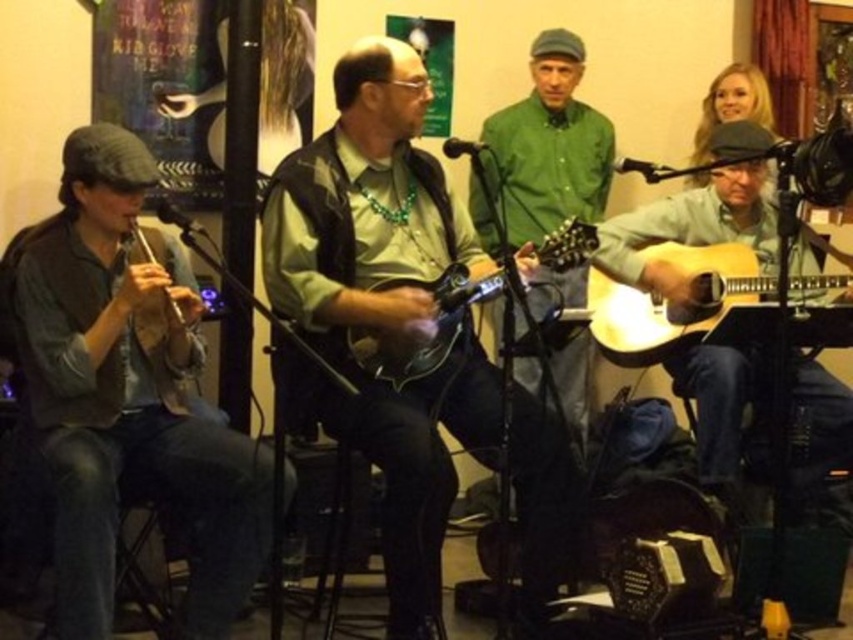
Locate an element on the screen. The width and height of the screenshot is (853, 640). brushed silver flute at left is located at coordinates (126, 396).

How distant is brushed silver flute at left from light brown wood guitar at right?

brushed silver flute at left is 6.16 feet away from light brown wood guitar at right.

Find the location of `brushed silver flute at left`. brushed silver flute at left is located at coordinates (126, 396).

I want to click on brushed silver flute at left, so click(x=126, y=396).

Does green matte mandolin at center appear under light brown wood guitar at right?

Yes.

Does point (564, 508) come farther from viewer compared to point (755, 237)?

No.

Is point (438, 212) less distant than point (848, 460)?

Yes, point (438, 212) is in front of point (848, 460).

Find the location of `green matte mandolin at center`. green matte mandolin at center is located at coordinates (381, 307).

Looking at this image, is brushed silver flute at left positioned in front of light wood acoustic guitar at right?

Yes, it is.

Who is more distant from viewer, (86, 564) or (659, 317)?

The point (659, 317) is behind.

Where is `brushed silver flute at left`? brushed silver flute at left is located at coordinates (126, 396).